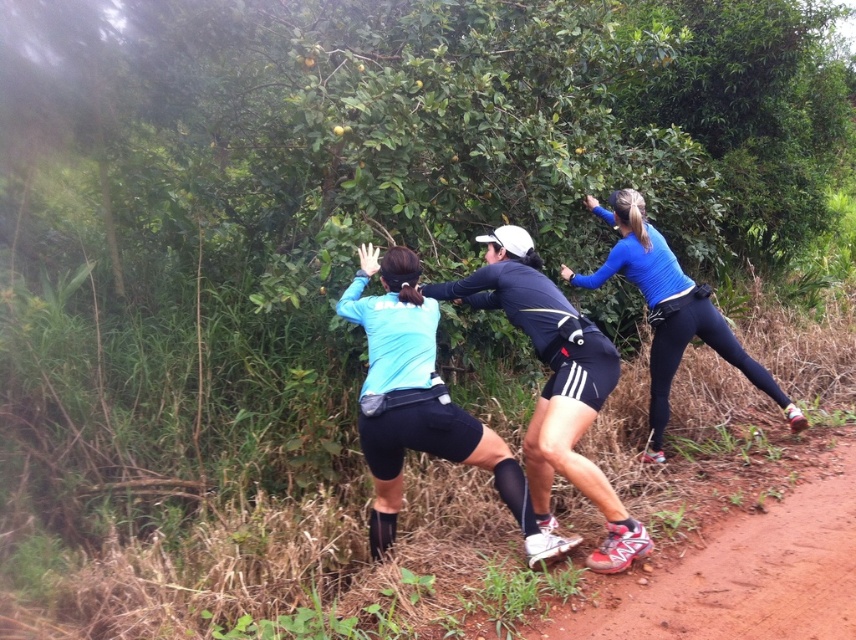
You are a photographer trying to capture a photo of the blue matte running top at center and the blue matte shirt at center. Which one do you need to zoom in on to make sure it appears larger in your photo?

The blue matte running top at center is not as tall as the blue matte shirt at center, so you should zoom in on the blue matte shirt at center to make it appear larger in the photo.